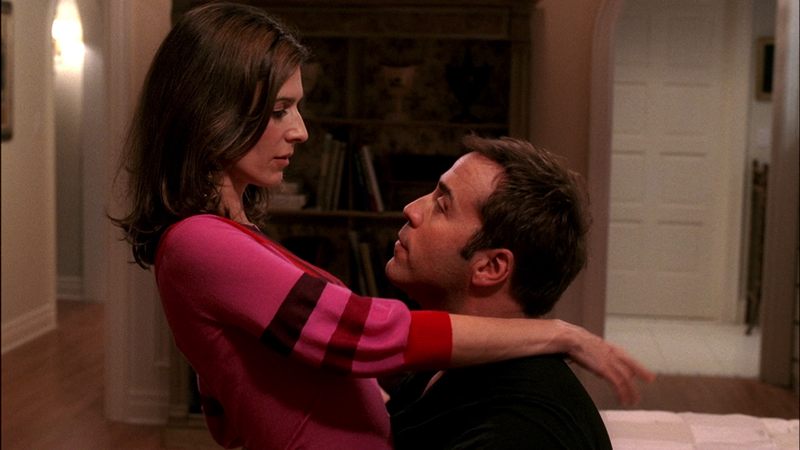
At what (x,y) coordinates should I click in order to perform the action: click on bookcase. Please return your answer as a coordinate pair (x, y). The height and width of the screenshot is (450, 800). Looking at the image, I should click on (474, 29).